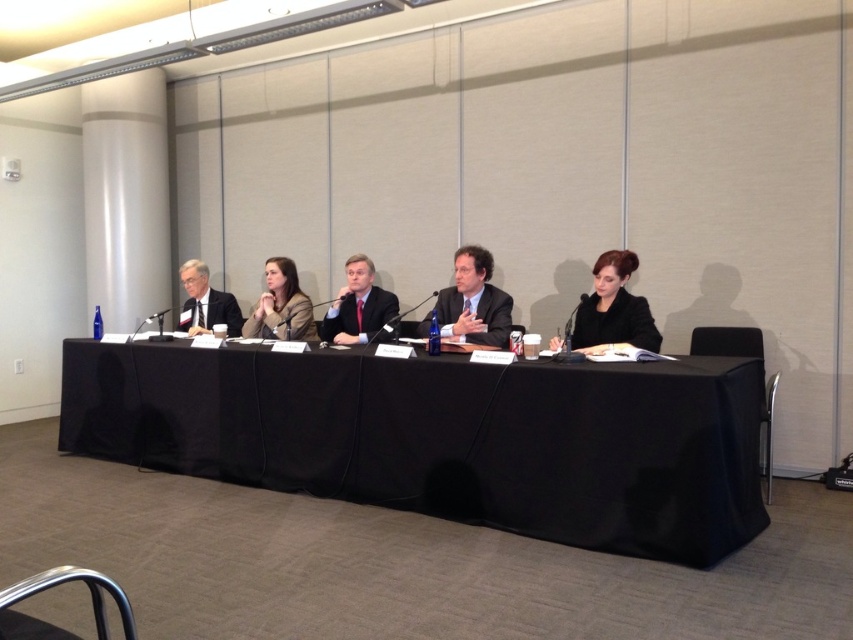
You are a photographer setting up for a group photo of the meeting participants. You have two points marked on your camera screen at coordinates point (473, 307) and point (230, 301). Which point is closer to the camera lens?

Point (473, 307) is closer to the viewer than point (230, 301), so the photographer should focus on that point first as it is nearer to the camera lens.

You are a server at a conference center who needs to place a 1.5 meter long tablecloth between the matte black suit at right and the matte brown blazer at center. Will the tablecloth be long enough to cover the space between them?

The distance between the matte black suit at right and the matte brown blazer at center is 2.02 meters. Since the tablecloth is only 1.5 meters long, it will not be long enough to cover the space between them.

You are a photographer setting up for a live stream of a panel discussion. The camera is placed at a certain distance from the black fabric table at center. If the recommended distance for clear video is 3 meters, is the camera positioned correctly?

The black fabric table at center and camera are 2.98 meters apart from each other. Since 2.98 meters is just slightly less than the recommended 3 meters, the camera is positioned correctly for clear video.